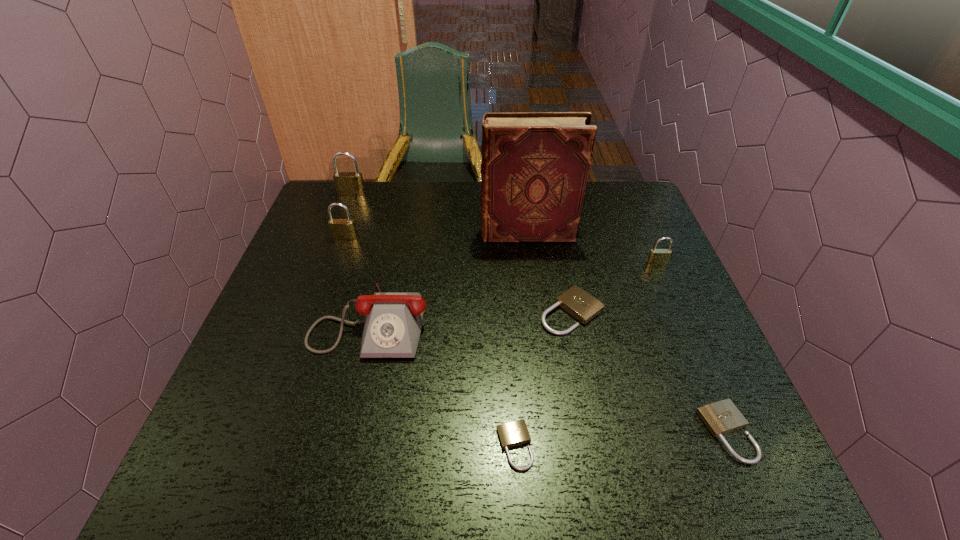
Locate an element on the screen. This screenshot has width=960, height=540. free space at the near edge of the desktop is located at coordinates (367, 450).

In order to click on vacant space at the right edge of the desktop in this screenshot , I will do `click(621, 254)`.

The height and width of the screenshot is (540, 960). I want to click on free location at the far left corner of the desktop, so click(x=358, y=220).

Find the location of `vacant space at the near left corner of the desktop`. vacant space at the near left corner of the desktop is located at coordinates (269, 488).

Find the location of a particular element. The image size is (960, 540). vacant space at the far right corner is located at coordinates (632, 192).

The image size is (960, 540). Identify the location of vacant space at the near right corner of the desktop. (703, 461).

The width and height of the screenshot is (960, 540). In order to click on vacant space in between the telephone and the sixth shortest object in this screenshot , I will do `click(358, 279)`.

Locate an element on the screen. The image size is (960, 540). vacant area that lies between the smallest brass padlock and the sixth shortest object is located at coordinates [501, 251].

The image size is (960, 540). In order to click on free area in between the telephone and the shortest object in this screenshot , I will do `click(443, 383)`.

The image size is (960, 540). I want to click on vacant area between the hardback book and the smallest brass padlock, so click(592, 248).